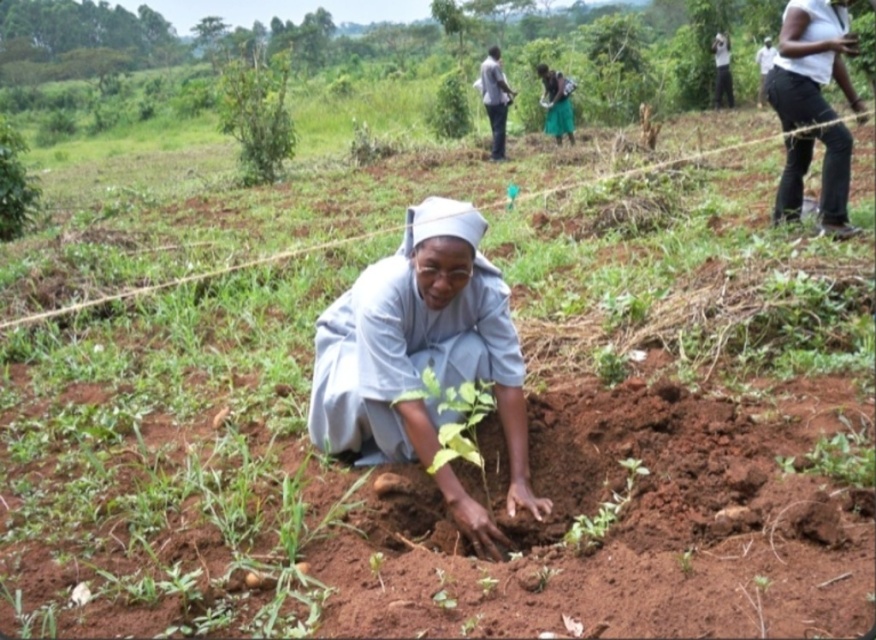
You are standing at the origin point of the image. There is a green fabric dress at upper center represented by point [556,104]. What is the direction of the green fabric dress at upper center from your current position?

The green fabric dress at upper center is located at point [556,104], which is in the upper center direction from the origin point.